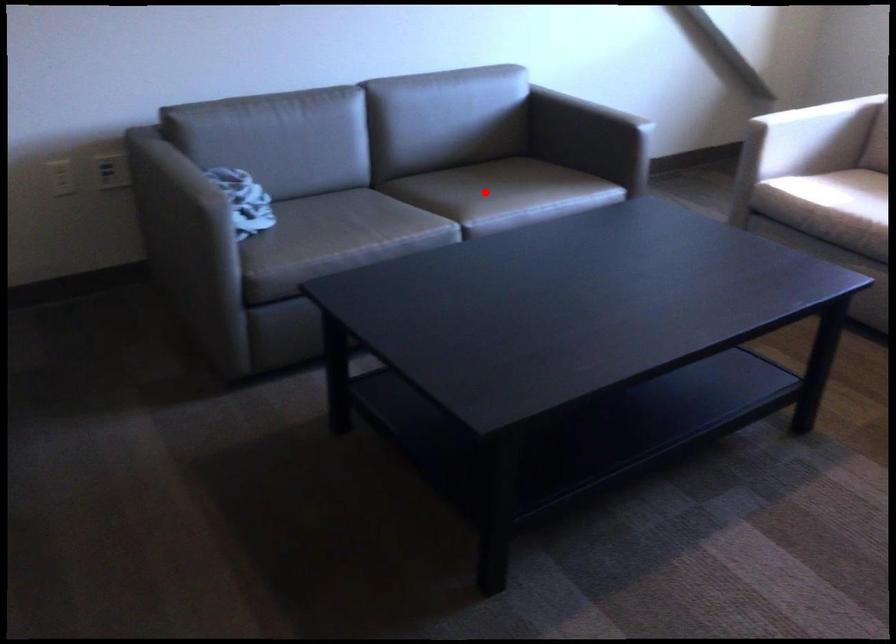
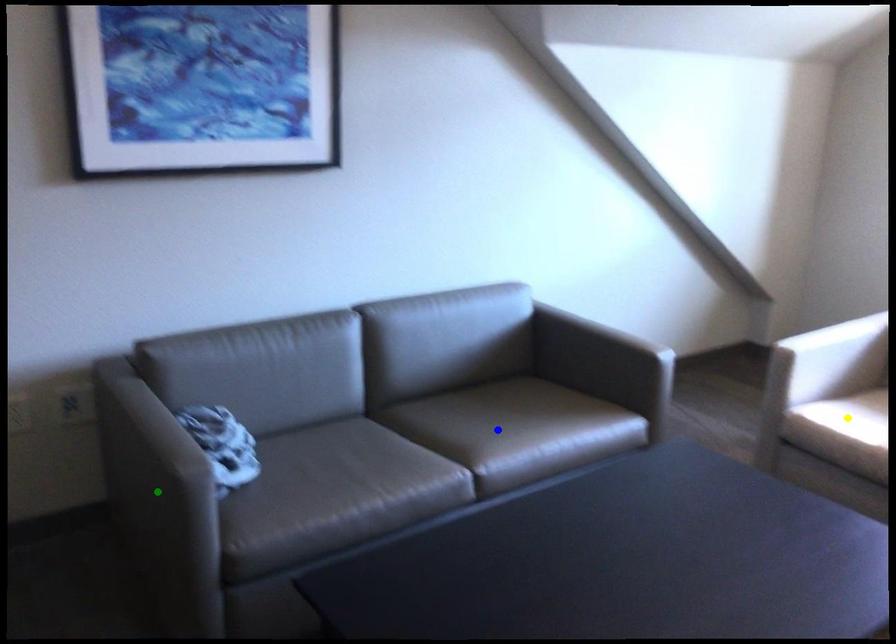
Question: I am providing you with two images of the same scene from different viewpoints. A red point is marked on the first image. You are given multiple points on the second image. Which point in image 2 is actually the same real-world point as the red point in image 1?

Choices:
 (A) blue point
 (B) yellow point
 (C) green point

Answer: (A)